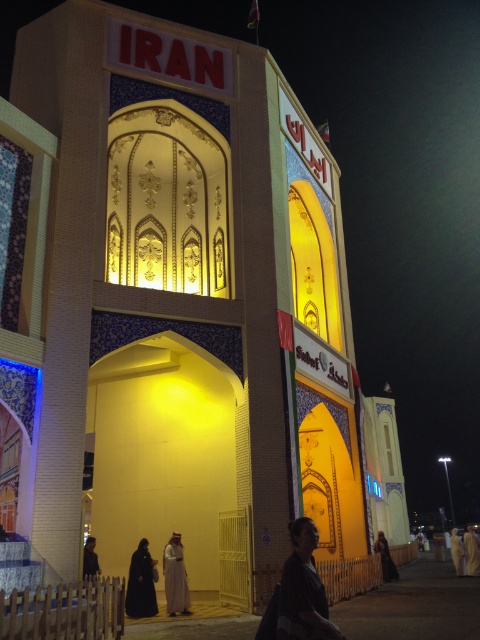
You are standing in front of the Iranian pavilion at night. You see a dark brown leather jacket at lower center and a white fabric person at lower right. Which object is smaller in size?

The dark brown leather jacket at lower center is smaller in size compared to the white fabric person at lower right.

You are a security guard assigned to monitor the entrance of the IRAN pavilion. You notice two items near the entrance area. The dark brown leather jacket at lower center and the black matte dress at lower left. Your handheld device indicates that the minimum safe distance between unattended items is 10 meters. Are both items within the required safety distance?

The dark brown leather jacket at lower center and the black matte dress at lower left are 10.95 meters apart from each other. Since 10.95 meters exceeds the minimum required distance of 10 meters, both items are within the safe distance requirement.